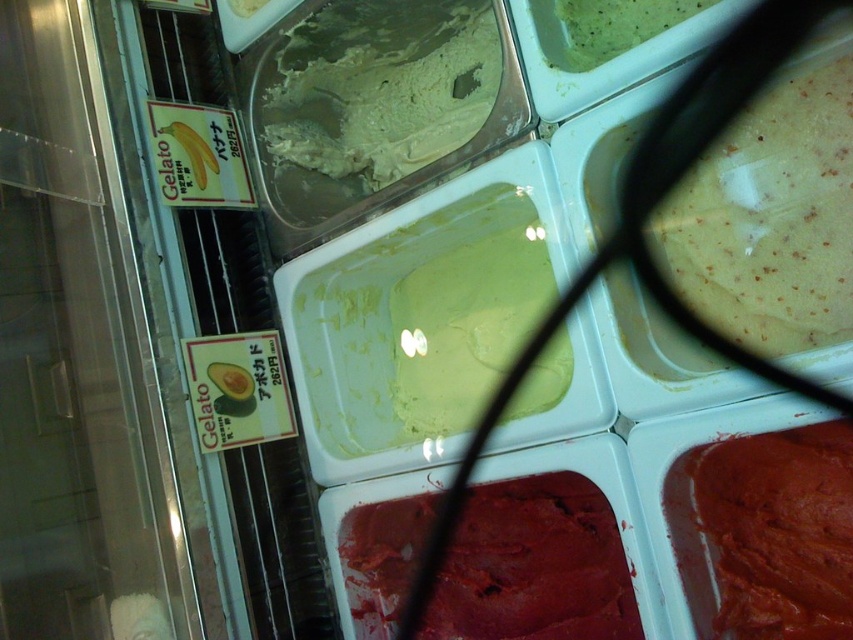
Does green matte ice cream at center appear on the right side of smooth chocolate ice cream at bottom right?

No, green matte ice cream at center is not to the right of smooth chocolate ice cream at bottom right.

Can you confirm if green matte ice cream at center is taller than smooth chocolate ice cream at bottom right?

Yes.

I want to click on green matte ice cream at center, so click(x=381, y=88).

Is smooth red gelato at bottom right shorter than smooth chocolate ice cream at bottom right?

No, smooth red gelato at bottom right is not shorter than smooth chocolate ice cream at bottom right.

Between smooth red gelato at bottom right and smooth chocolate ice cream at bottom right, which one has less height?

smooth chocolate ice cream at bottom right is shorter.

Is point (354, 608) farther from viewer compared to point (839, 440)?

That is True.

The image size is (853, 640). What are the coordinates of `smooth red gelato at bottom right` in the screenshot? It's located at (534, 564).

Consider the image. Between green matte gelato at center and green creamy ice cream at upper right, which one appears on the right side from the viewer's perspective?

green creamy ice cream at upper right

Find the location of a particular element. The height and width of the screenshot is (640, 853). green matte gelato at center is located at coordinates (415, 320).